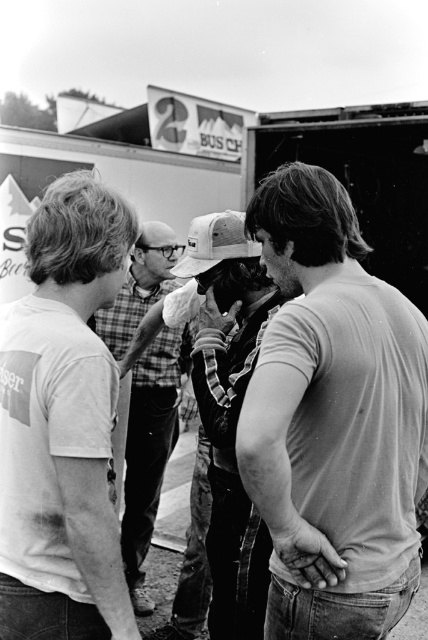
Find the location of a particular element. Image resolution: width=428 pixels, height=640 pixels. white cotton t-shirt at left is located at coordinates (62, 424).

Is white cotton t-shirt at left positioned in front of plaid shirt at center?

Yes, it is.

Locate an element on the screen. Image resolution: width=428 pixels, height=640 pixels. white cotton t-shirt at left is located at coordinates (62, 424).

At what (x,y) coordinates should I click in order to perform the action: click on white cotton t-shirt at left. Please return your answer as a coordinate pair (x, y). Image resolution: width=428 pixels, height=640 pixels. Looking at the image, I should click on (62, 424).

Who is more distant from viewer, (294, 445) or (107, 316)?

The point (107, 316) is more distant.

Is smooth white t-shirt at center to the right of plaid shirt at center from the viewer's perspective?

Correct, you'll find smooth white t-shirt at center to the right of plaid shirt at center.

What are the coordinates of `smooth white t-shirt at center` in the screenshot? It's located at (332, 419).

Is point (226, 252) positioned before point (169, 232)?

Yes.

Does denim jacket at center have a larger size compared to plaid shirt at center?

Correct, denim jacket at center is larger in size than plaid shirt at center.

Is point (219, 621) more distant than point (140, 474)?

No, it is in front of (140, 474).

Identify the location of denim jacket at center. (228, 412).